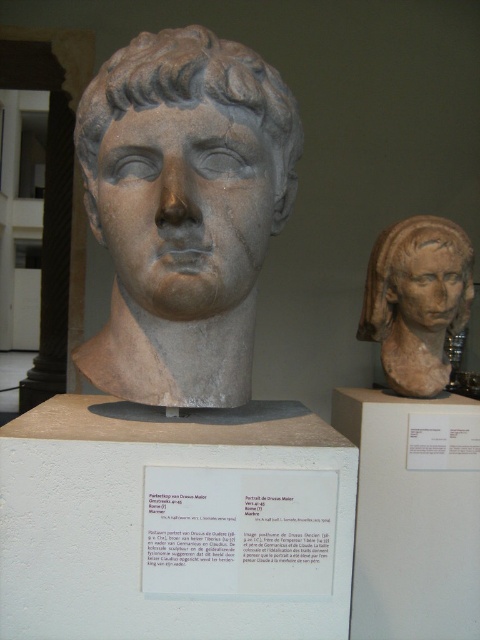
Consider the image. Is gray stone head at center bigger than brown clay head at upper right?

Actually, gray stone head at center might be smaller than brown clay head at upper right.

Is gray stone head at center shorter than brown clay head at upper right?

Correct, gray stone head at center is not as tall as brown clay head at upper right.

At what (x,y) coordinates should I click in order to perform the action: click on gray stone head at center. Please return your answer as a coordinate pair (x, y). This screenshot has width=480, height=640. Looking at the image, I should click on (190, 99).

Can you confirm if matte stone bust at right is thinner than brown clay head at upper right?

In fact, matte stone bust at right might be wider than brown clay head at upper right.

Identify the location of matte stone bust at right. This screenshot has height=640, width=480. (411, 516).

Is the position of matte stone bust at right more distant than that of gray stone head at center?

Yes, it is behind gray stone head at center.

Does point (456, 593) come behind point (158, 74)?

Yes, point (456, 593) is farther from viewer.

The height and width of the screenshot is (640, 480). I want to click on matte stone bust at right, so click(411, 516).